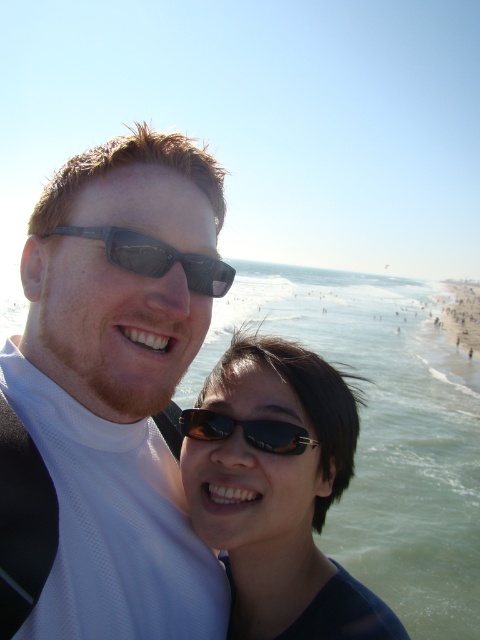
Question: Considering the real-world distances, which object is farthest from the black matte sunglasses at center?

Choices:
 (A) matte black sunglasses at upper left
 (B) black matte sunglasses at upper center

Answer: (B)

Question: Which object is positioned closest to the matte black sunglasses at upper left?

Choices:
 (A) black matte sunglasses at upper center
 (B) black matte sunglasses at center

Answer: (A)

Question: Is black matte sunglasses at center bigger than sunglasses at center?

Choices:
 (A) yes
 (B) no

Answer: (A)

Question: Which point appears closest to the camera in this image?

Choices:
 (A) (49, 456)
 (B) (216, 284)

Answer: (A)

Question: From the image, what is the correct spatial relationship of clear blue water at center in relation to black matte sunglasses at upper center?

Choices:
 (A) right
 (B) left

Answer: (B)

Question: Is matte black sunglasses at upper left bigger than black matte sunglasses at center?

Choices:
 (A) no
 (B) yes

Answer: (B)